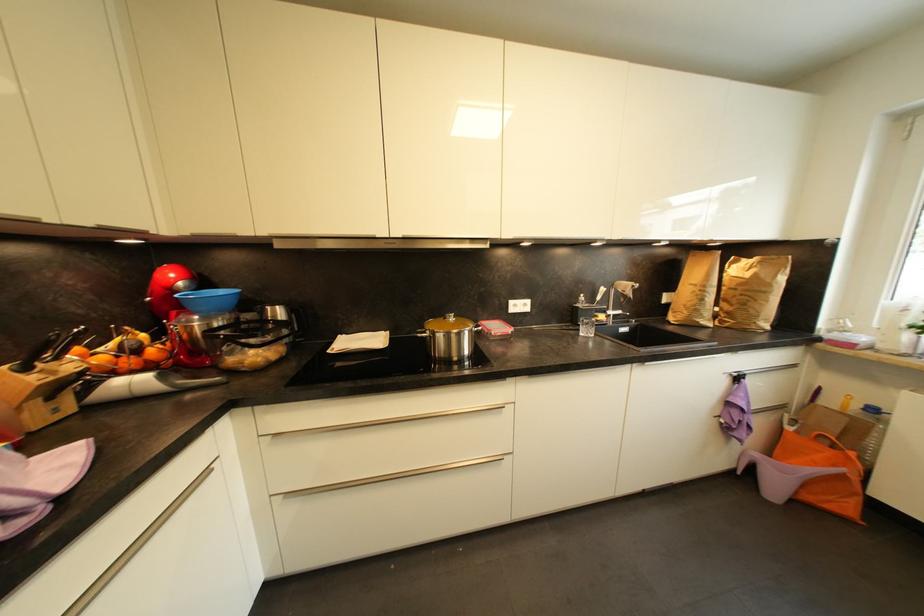
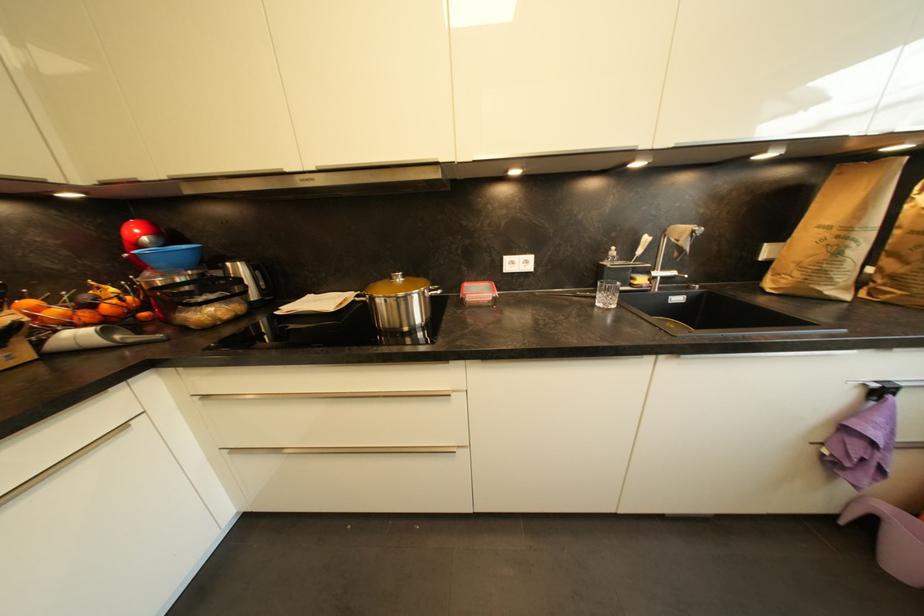
Question: The camera is either moving clockwise (left) or counter-clockwise (right) around the object. The first image is from the beginning of the video and the second image is from the end. Is the camera moving left or right when shooting the video?

Choices:
 (A) Left
 (B) Right

Answer: (B)